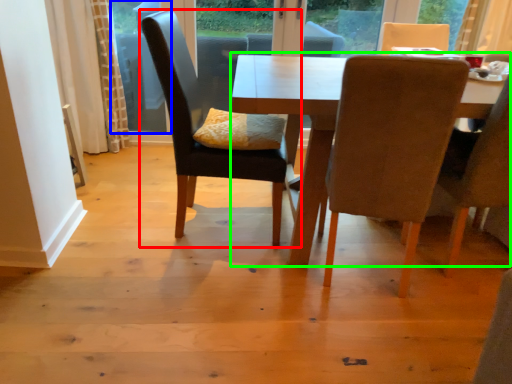
Question: Considering the real-world distances, which object is farthest from chair (highlighted by a red box)? window screen (highlighted by a blue box) or kitchen & dining room table (highlighted by a green box)?

Choices:
 (A) window screen
 (B) kitchen & dining room table

Answer: (A)